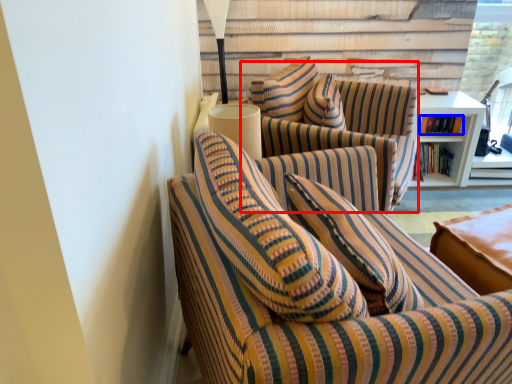
Question: Which of the following is the farthest to the observer, swivel chair (highlighted by a red box) or book (highlighted by a blue box)?

Choices:
 (A) swivel chair
 (B) book

Answer: (B)